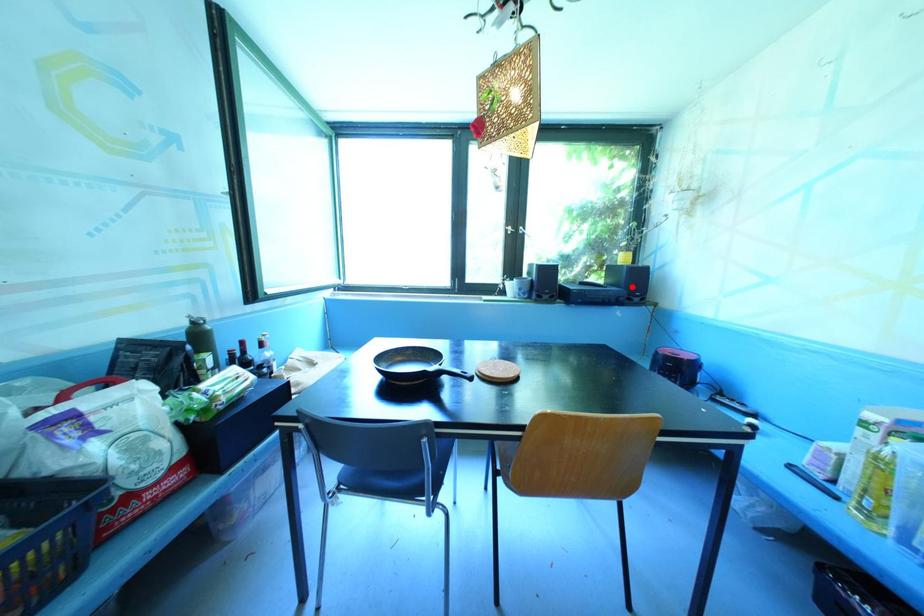
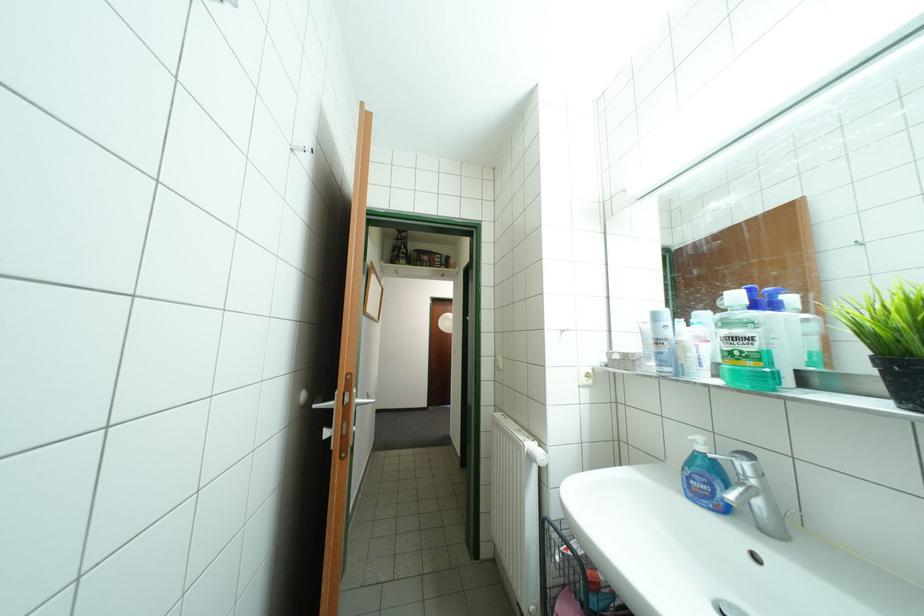
Question: I am providing you with two images of the same scene from different viewpoints. A red point is marked on the first image. Can you still see the location of the red point in image 2?

Choices:
 (A) Yes
 (B) No

Answer: (B)